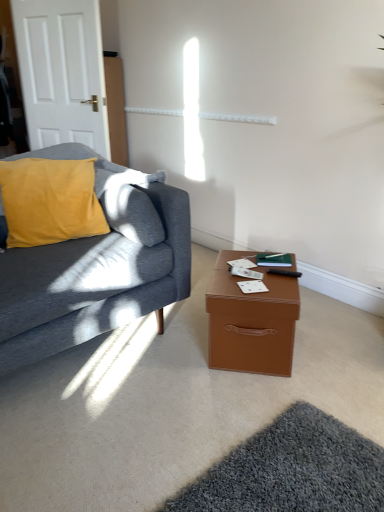
Question: Is brown leather-like box at lower right smaller than velvet yellow pillow at left?

Choices:
 (A) yes
 (B) no

Answer: (A)

Question: Can you confirm if brown leather-like box at lower right is wider than velvet yellow pillow at left?

Choices:
 (A) no
 (B) yes

Answer: (B)

Question: From the image's perspective, is brown leather-like box at lower right below velvet yellow pillow at left?

Choices:
 (A) yes
 (B) no

Answer: (A)

Question: Would you say brown leather-like box at lower right is outside velvet yellow pillow at left?

Choices:
 (A) no
 (B) yes

Answer: (B)

Question: From a real-world perspective, is brown leather-like box at lower right positioned over velvet yellow pillow at left based on gravity?

Choices:
 (A) no
 (B) yes

Answer: (A)

Question: From the image's perspective, is brown leather-like box at lower right on top of velvet yellow pillow at left?

Choices:
 (A) yes
 (B) no

Answer: (B)

Question: Is the position of velvet yellow pillow at left more distant than that of black plastic remote control at lower right?

Choices:
 (A) no
 (B) yes

Answer: (A)

Question: Can you confirm if velvet yellow pillow at left is bigger than black plastic remote control at lower right?

Choices:
 (A) no
 (B) yes

Answer: (B)

Question: Is velvet yellow pillow at left shorter than black plastic remote control at lower right?

Choices:
 (A) yes
 (B) no

Answer: (B)

Question: From the image's perspective, would you say velvet yellow pillow at left is positioned over black plastic remote control at lower right?

Choices:
 (A) no
 (B) yes

Answer: (B)

Question: Is velvet yellow pillow at left thinner than black plastic remote control at lower right?

Choices:
 (A) yes
 (B) no

Answer: (B)

Question: Would you consider velvet yellow pillow at left to be distant from black plastic remote control at lower right?

Choices:
 (A) yes
 (B) no

Answer: (A)

Question: Does black plastic remote control at lower right have a greater height compared to brown leather-like box at lower right?

Choices:
 (A) no
 (B) yes

Answer: (A)